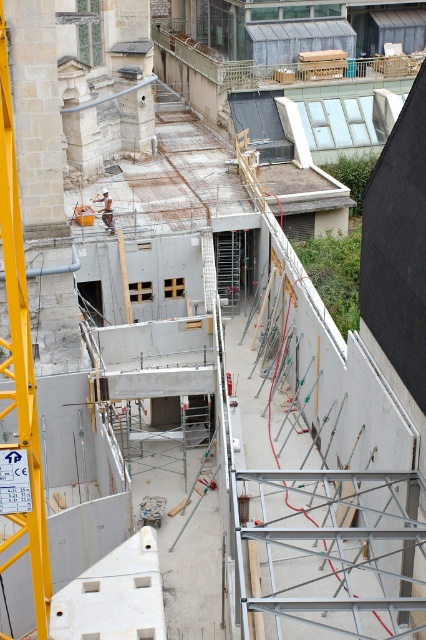
Question: Is yellow metallic crane at left smaller than light brown wooden construction worker at center?

Choices:
 (A) yes
 (B) no

Answer: (A)

Question: Which point appears closest to the camera in this image?

Choices:
 (A) click(x=36, y=436)
 (B) click(x=103, y=195)

Answer: (A)

Question: Which object is farther from the camera taking this photo?

Choices:
 (A) light brown wooden construction worker at center
 (B) yellow metallic crane at left

Answer: (A)

Question: Is yellow metallic crane at left bigger than light brown wooden construction worker at center?

Choices:
 (A) yes
 (B) no

Answer: (B)

Question: In this image, where is yellow metallic crane at left located relative to light brown wooden construction worker at center?

Choices:
 (A) above
 (B) below

Answer: (B)